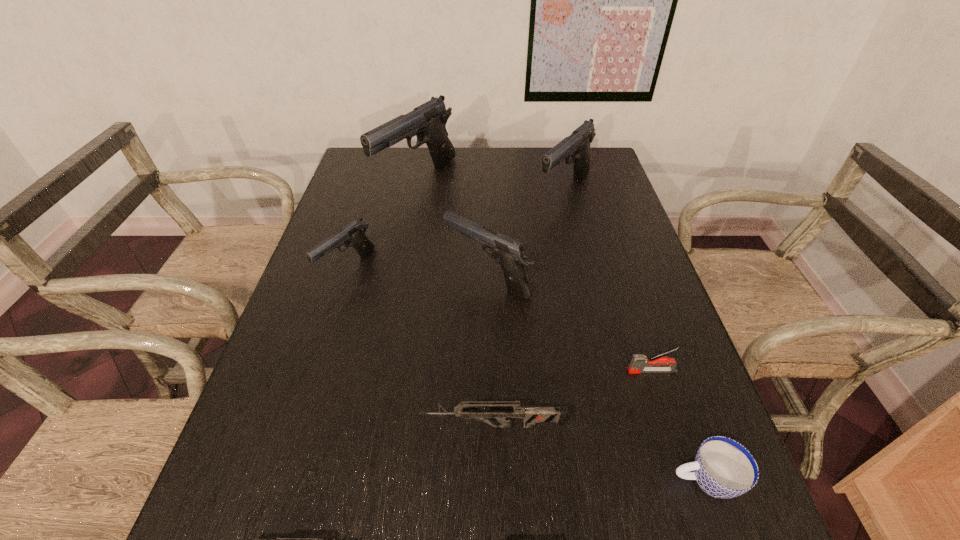
Where is `black gun that is the fourth closest to the gray stapler`? The width and height of the screenshot is (960, 540). black gun that is the fourth closest to the gray stapler is located at coordinates (428, 121).

Identify which black gun is located as the second nearest to the second tallest object. Please provide its 2D coordinates. Your answer should be formatted as a tuple, i.e. [(x, y)], where the tuple contains the x and y coordinates of a point satisfying the conditions above.

[(428, 121)]

I want to click on grey gun that is the closest one to the seventh tallest object, so click(x=531, y=415).

Locate an element on the screen. This screenshot has width=960, height=540. the closest grey gun to the second smallest black gun is located at coordinates (531, 415).

The width and height of the screenshot is (960, 540). In order to click on vacant position in the image that satisfies the following two spatial constraints: 1. at the muzzle of the second tallest gun; 2. at the muzzle of the fourth shortest gun in this screenshot , I will do `click(586, 278)`.

Where is `free region that satisfies the following two spatial constraints: 1. at the muzzle of the second tallest object; 2. aimed along the barrel of the third nearest object`? The image size is (960, 540). free region that satisfies the following two spatial constraints: 1. at the muzzle of the second tallest object; 2. aimed along the barrel of the third nearest object is located at coordinates (622, 426).